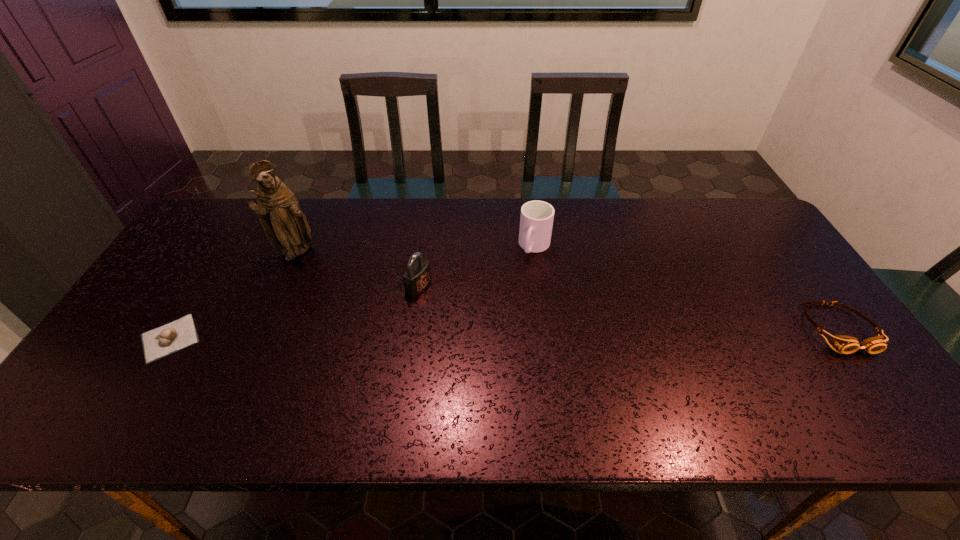
The height and width of the screenshot is (540, 960). Identify the location of free space located 0.050m with the lenses facing forward on the goggles. (871, 374).

This screenshot has width=960, height=540. I want to click on free location located 0.220m on the front of the third object from right to left near the keyhole, so click(x=496, y=325).

This screenshot has height=540, width=960. I want to click on free space located on the front of the third object from right to left near the keyhole, so click(x=553, y=352).

This screenshot has height=540, width=960. In order to click on free space located on the front of the third object from right to left near the keyhole in this screenshot , I will do `click(496, 325)`.

Locate an element on the screen. The image size is (960, 540). free location located 0.390m on the front-facing side of the tallest object is located at coordinates (413, 313).

The width and height of the screenshot is (960, 540). In order to click on vacant space located 0.250m on the front-facing side of the tallest object in this screenshot , I will do `click(373, 292)`.

In order to click on vacant space located 0.260m on the front-facing side of the tallest object in this screenshot , I will do `click(376, 293)`.

Where is `vacant space located 0.110m with the handle on the side of the fourth object from left to right`? The height and width of the screenshot is (540, 960). vacant space located 0.110m with the handle on the side of the fourth object from left to right is located at coordinates (519, 286).

This screenshot has height=540, width=960. I want to click on free space located 0.200m with the handle on the side of the fourth object from left to right, so click(x=509, y=308).

You are a GUI agent. You are given a task and a screenshot of the screen. Output one action in this format:
    pyautogui.click(x=<x>, y=<y>)
    Task: Click on the blank space located 0.180m with the handle on the side of the fourth object from left to right
    The image size is (960, 540).
    Given the screenshot: What is the action you would take?
    pyautogui.click(x=511, y=303)